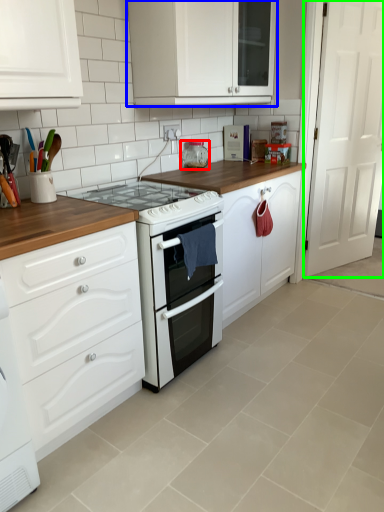
Question: Which object is the farthest from appliance (highlighted by a red box)? Choose among these: cabinetry (highlighted by a blue box) or door (highlighted by a green box).

Choices:
 (A) cabinetry
 (B) door

Answer: (B)